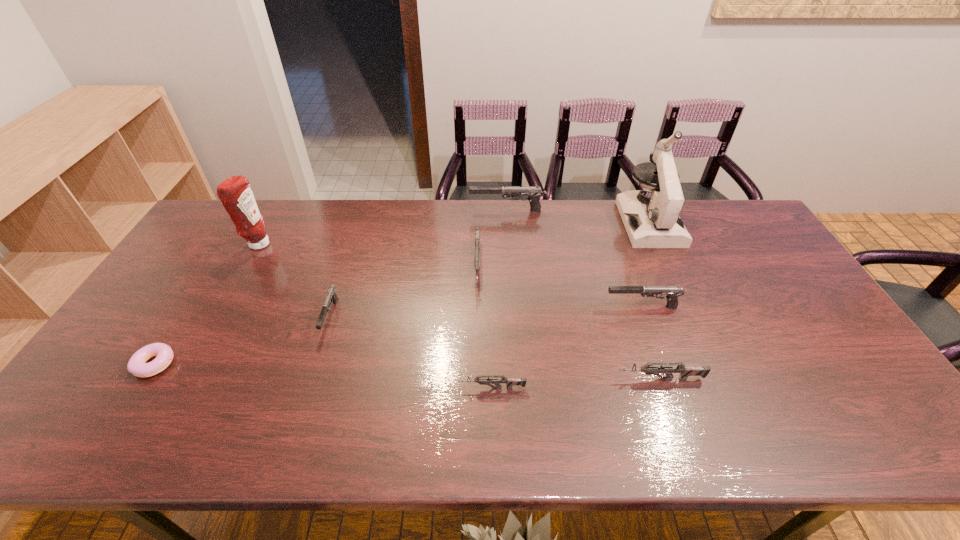
In order to click on object that stands as the fourth closest to the tallest object in this screenshot , I will do `click(477, 229)`.

Where is `gun object that ranks as the sixth closest to the purple doughnut`? The image size is (960, 540). gun object that ranks as the sixth closest to the purple doughnut is located at coordinates (673, 292).

Find the location of a particular element. the second closest gun to the fifth farthest gun is located at coordinates (481, 379).

Identify which gray gun is the closest to the second biggest gray gun. Please provide its 2D coordinates. Your answer should be formatted as a tuple, i.e. [(x, y)], where the tuple contains the x and y coordinates of a point satisfying the conditions above.

[(533, 193)]

Select which gray gun appears as the second closest to the biggest grey gun. Please provide its 2D coordinates. Your answer should be formatted as a tuple, i.e. [(x, y)], where the tuple contains the x and y coordinates of a point satisfying the conditions above.

[(673, 292)]

This screenshot has height=540, width=960. What are the coordinates of `grey gun identified as the second closest to the nearest object` in the screenshot? It's located at (477, 229).

In order to click on grey gun that is the nearest to the farthest grey gun in this screenshot , I will do `click(481, 379)`.